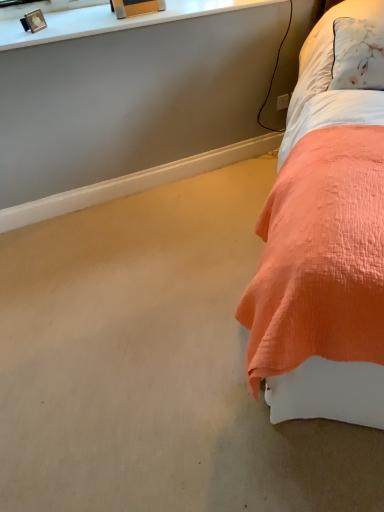
Find the location of a particular element. This screenshot has width=384, height=512. free point in front of metallic gold picture frame at upper left is located at coordinates (33, 38).